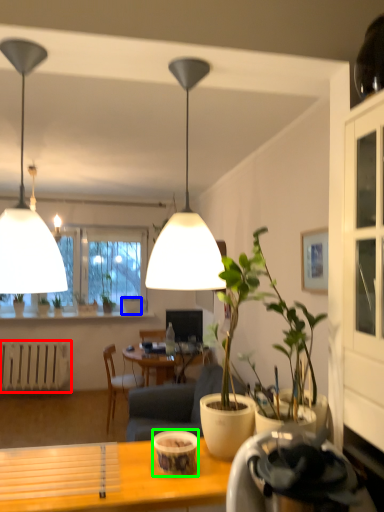
Question: Which object is the farthest from radiator (highlighted by a red box)? Choose among these: flowerpot (highlighted by a blue box) or coffee cup (highlighted by a green box).

Choices:
 (A) flowerpot
 (B) coffee cup

Answer: (B)